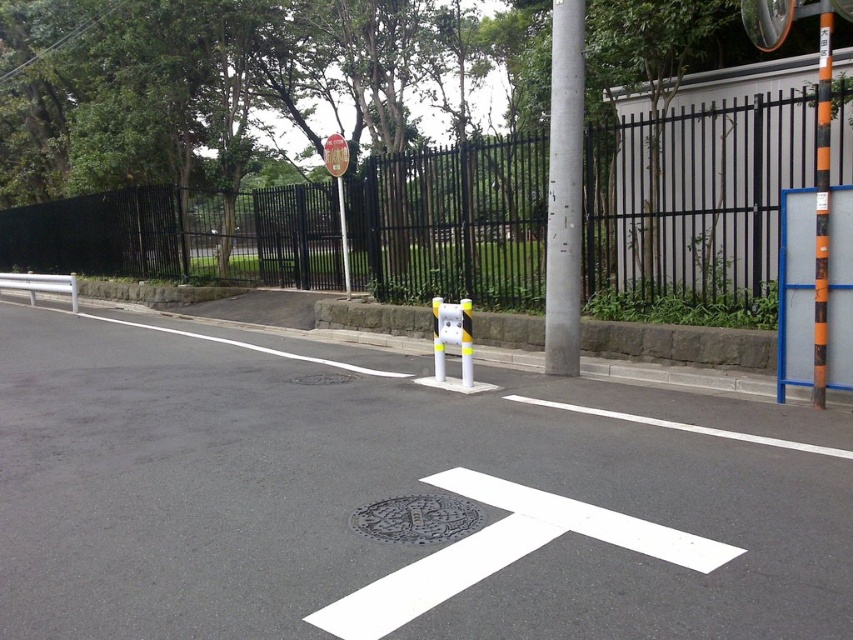
Can you confirm if orange/black striped pole at right is positioned above metallic reflective sign at upper center?

No.

You are a GUI agent. You are given a task and a screenshot of the screen. Output one action in this format:
    pyautogui.click(x=<x>, y=<y>)
    Task: Click on the orange/black striped pole at right
    The width and height of the screenshot is (853, 640).
    Given the screenshot: What is the action you would take?
    pyautogui.click(x=821, y=196)

Does point (813, 387) lie behind point (344, 220)?

No, (813, 387) is in front of (344, 220).

Find the location of a particular element. This screenshot has width=853, height=640. orange/black striped pole at right is located at coordinates (821, 196).

Between black metal fence at center and metallic pole at center, which one has less height?

metallic pole at center

Can you confirm if black metal fence at center is positioned to the left of metallic pole at center?

Indeed, black metal fence at center is positioned on the left side of metallic pole at center.

Locate an element on the screen. This screenshot has height=640, width=853. black metal fence at center is located at coordinates (695, 193).

The image size is (853, 640). Describe the element at coordinates (695, 193) in the screenshot. I see `black metal fence at center` at that location.

Is black metal fence at center closer to camera compared to silver metallic pole at upper center?

Yes.

Does point (604, 129) come in front of point (550, 259)?

No, (604, 129) is behind (550, 259).

At what (x,y) coordinates should I click in order to perform the action: click on black metal fence at center. Please return your answer as a coordinate pair (x, y). Looking at the image, I should click on (695, 193).